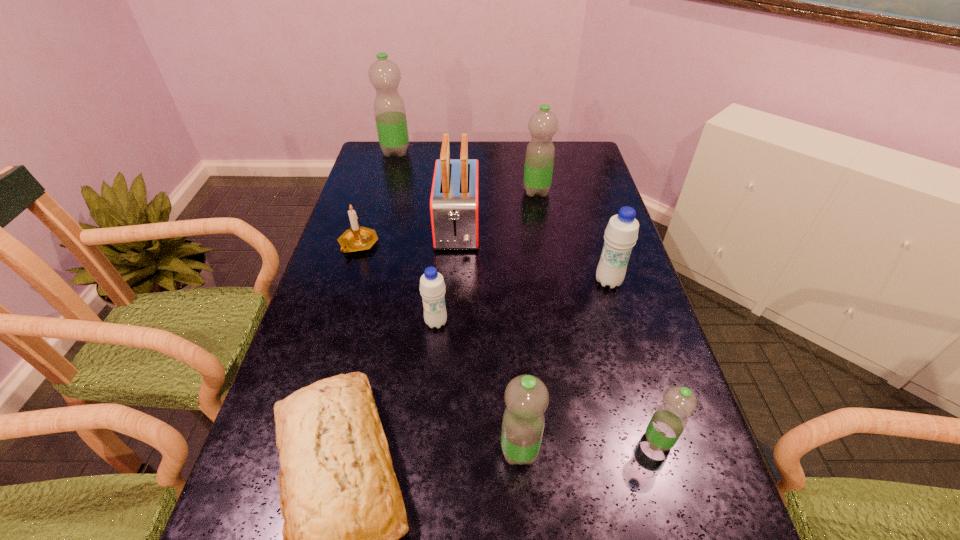
Locate an element on the screen. The width and height of the screenshot is (960, 540). green water bottle that is the closest to the farthest green water bottle is located at coordinates (540, 153).

Where is `green water bottle that is the third nearest to the bread`? green water bottle that is the third nearest to the bread is located at coordinates click(540, 153).

Locate an element on the screen. The width and height of the screenshot is (960, 540). vacant space that satisfies the following two spatial constraints: 1. on the front side of the rightmost green water bottle; 2. on the left side of the bigger blue water bottle is located at coordinates click(656, 441).

Where is `vacant position in the image that satisfies the following two spatial constraints: 1. on the front side of the right blue water bottle; 2. on the left side of the smallest green water bottle`? This screenshot has height=540, width=960. vacant position in the image that satisfies the following two spatial constraints: 1. on the front side of the right blue water bottle; 2. on the left side of the smallest green water bottle is located at coordinates (656, 441).